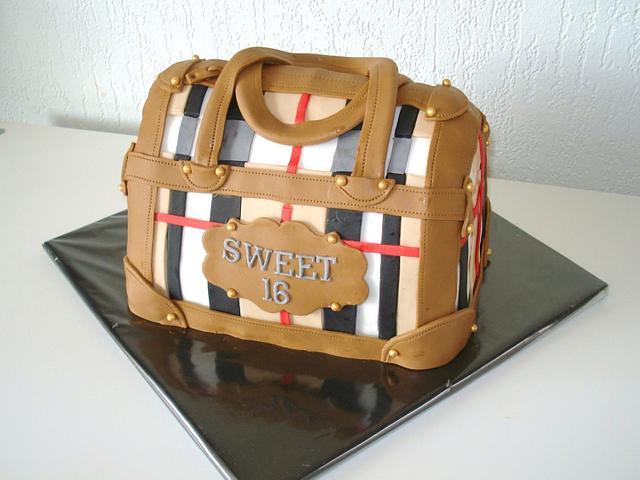
I want to click on table, so (506, 434).